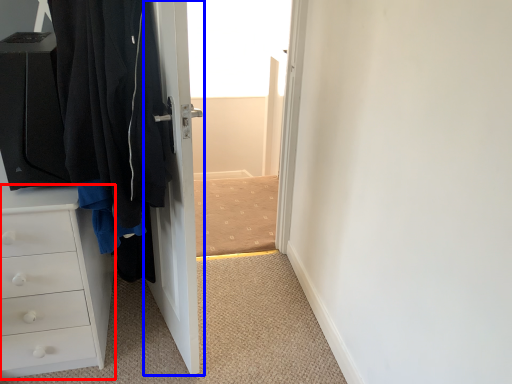
Question: Which of the following is the closest to the observer, chest of drawers (highlighted by a red box) or door (highlighted by a blue box)?

Choices:
 (A) chest of drawers
 (B) door

Answer: (B)